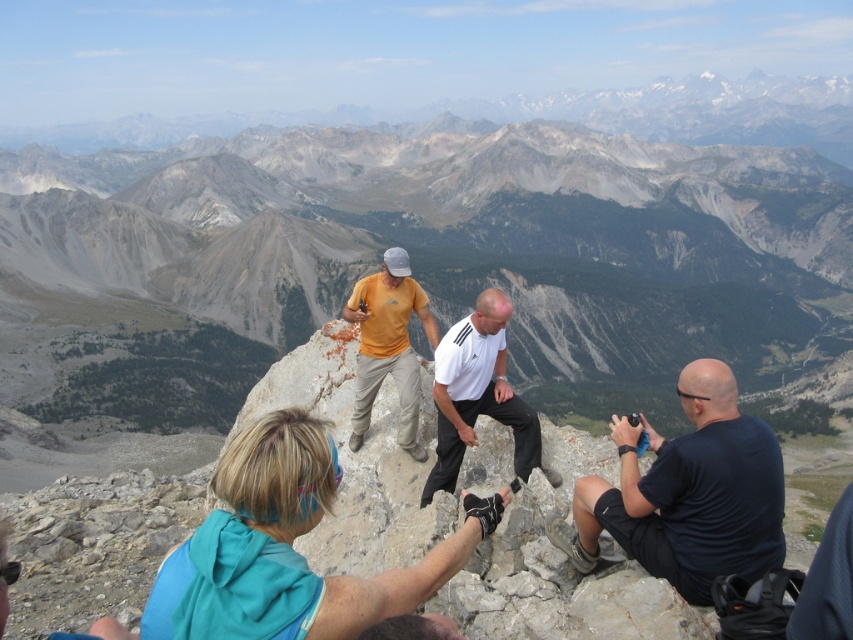
You are a photographer trying to capture a group photo of the blue fabric at center and the yellow matte shirt at center. Based on their positions, which one should you place on the left side of the frame to align with their actual arrangement?

The blue fabric at center is positioned on the right side of yellow matte shirt at center, so to align with their actual arrangement, you should place the yellow matte shirt at center on the left side of the frame.

You are a hiker who wants to place a small flag at the exact location of the blue fabric at center. Given that the coordinate system starts at the bottom left corner of the image, with x increasing to the right and y increasing upwards, can you confirm the coordinates where you should place the flag?

The blue fabric at center should be placed at coordinates point (286,548) as per the given description.

You are a photographer trying to capture a shot of the blue fabric at center and the white matte shirt at center. Which object should you zoom in on to ensure both are in frame without moving the camera?

The blue fabric at center is bigger than the white matte shirt at center, so you should zoom in on the white matte shirt at center to ensure both are in frame without moving the camera.